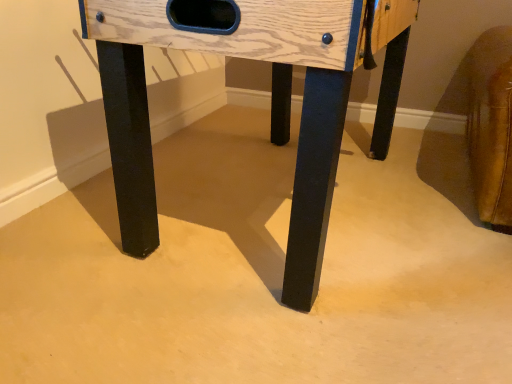
What do you see at coordinates (272, 98) in the screenshot?
I see `black glossy table legs at center` at bounding box center [272, 98].

You are a GUI agent. You are given a task and a screenshot of the screen. Output one action in this format:
    pyautogui.click(x=<x>, y=<y>)
    Task: Click on the black glossy table legs at center
    
    Given the screenshot: What is the action you would take?
    pyautogui.click(x=272, y=98)

At what (x,y) coordinates should I click in order to perform the action: click on black glossy table legs at center. Please return your answer as a coordinate pair (x, y). The image size is (512, 384). Looking at the image, I should click on (272, 98).